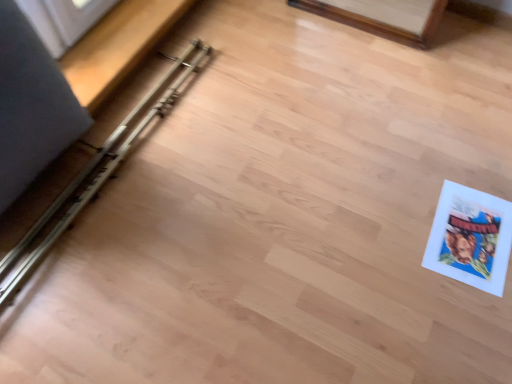
What are the coordinates of `free space to the back side of metallic silver rail at left` in the screenshot? It's located at (173, 61).